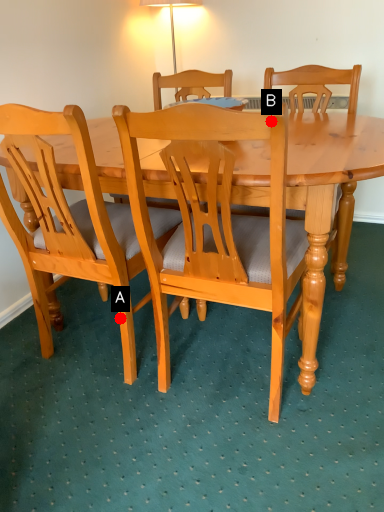
Question: Two points are circled on the image, labeled by A and B beside each circle. Which of the following is the farthest from the observer?

Choices:
 (A) A is further
 (B) B is further

Answer: (A)